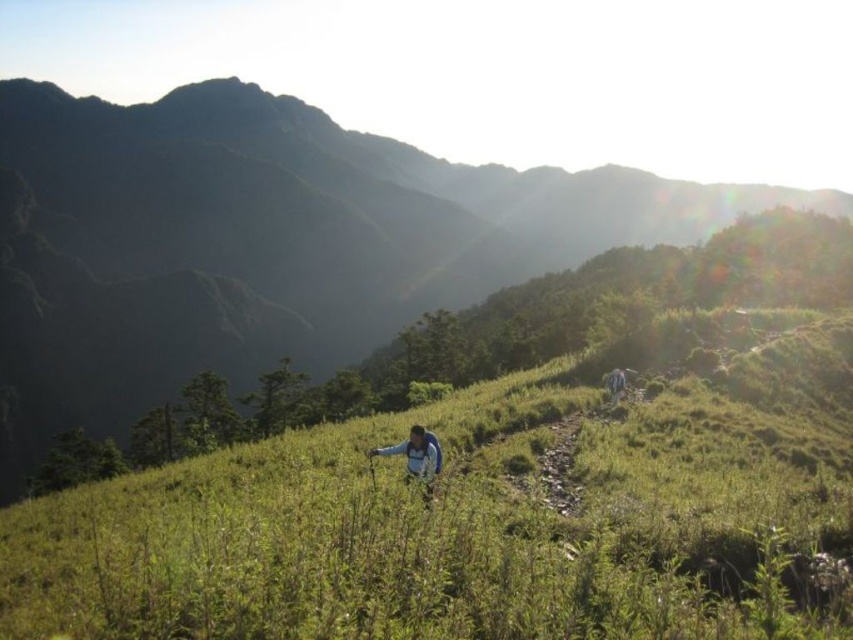
You are a hiker planning to take a photo of the blue fabric jacket at upper right and the green grassy hillside at center. Which object should you focus on first if you want to capture both in a single frame without moving the camera?

The blue fabric jacket at upper right should be focused on first because the green grassy hillside at center is wider and will occupy more of the frame, ensuring both are captured without needing to adjust the camera position.

You are a hiker trying to locate your two jackets in the mountain scene. You remember that one is a blue fleece jacket at center and the other is a blue fabric jacket at upper right. Based on their positions, which jacket is closer to the path you are walking on?

The blue fleece jacket at center is closer to the path you are walking on because it is positioned to the left of the blue fabric jacket at upper right, which places it nearer to the path in the scene.

You are a hiker preparing to take a photo of the green grassy hillside at center and the blue fleece jacket at center. Which object should you focus on first if you want both to be in sharp focus?

The green grassy hillside at center is taller than the blue fleece jacket at center, so you should focus on the green grassy hillside at center first to ensure both are in sharp focus.